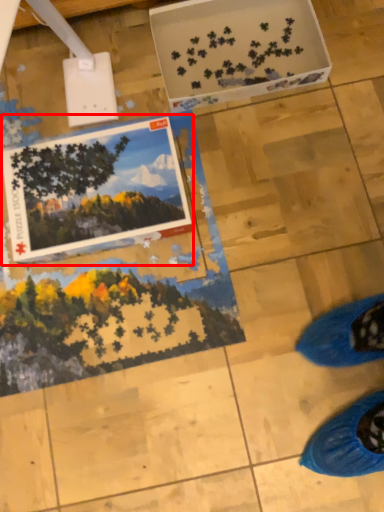
Question: From the image's perspective, where is postcard (annotated by the red box) located relative to cardboard box?

Choices:
 (A) below
 (B) above

Answer: (A)